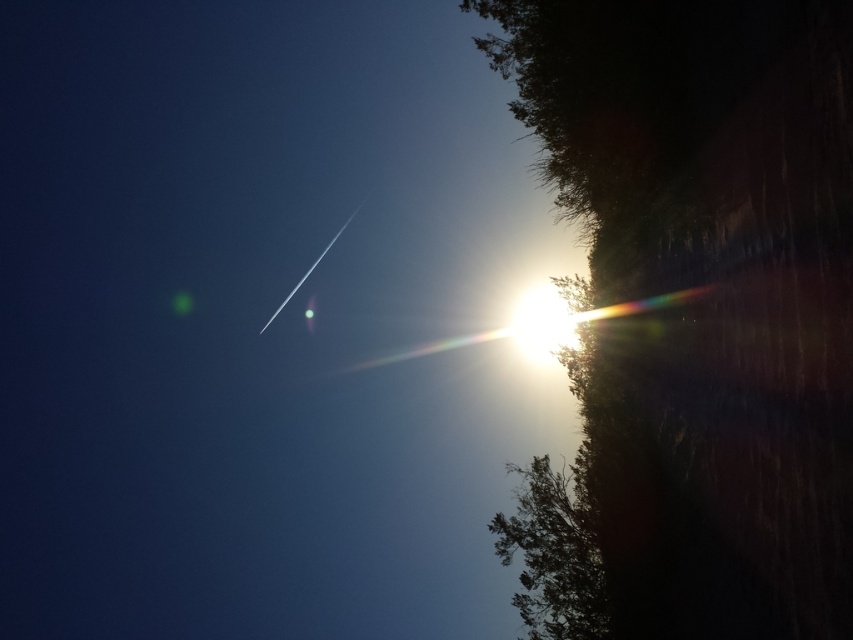
You are a photographer who wants to capture a photo of the silhouette leafy tree at right and the green leafy tree at lower right. Based on their heights, which tree would appear larger in the photo?

The silhouette leafy tree at right is much taller than the green leafy tree at lower right, so it would appear larger in the photo.

You are an observer looking at the scene. Which tree, the silhouette leafy tree at right or the green leafy tree at lower right, is positioned closer to you?

The silhouette leafy tree at right is closer to the viewer than the green leafy tree at lower right.

You are an observer looking at the scene. Which tree, the silhouette leafy tree at right or the green leafy tree at lower right, has a larger width?

The silhouette leafy tree at right might be wider than the green leafy tree at lower right according to the description.